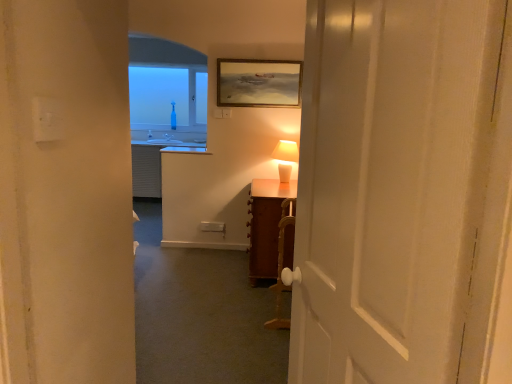
Image resolution: width=512 pixels, height=384 pixels. What do you see at coordinates (404, 194) in the screenshot?
I see `white wooden door at center` at bounding box center [404, 194].

Describe the element at coordinates (223, 113) in the screenshot. I see `white plastic electric outlet at upper center` at that location.

Measure the distance between wooden cabinet at right and camera.

They are 10.57 feet apart.

Identify the location of white wooden door at center. (404, 194).

Based on their sizes in the image, would you say wooden cabinet at right is bigger or smaller than white ceramic table lamp at center?

wooden cabinet at right is bigger than white ceramic table lamp at center.

Considering the sizes of objects wooden cabinet at right and white ceramic table lamp at center in the image provided, who is wider, wooden cabinet at right or white ceramic table lamp at center?

wooden cabinet at right.

Is wooden cabinet at right far from white ceramic table lamp at center?

wooden cabinet at right is actually quite close to white ceramic table lamp at center.

Is the depth of white plastic electric outlet at upper center greater than that of wooden cabinet at center?

Yes, the depth of white plastic electric outlet at upper center is greater than that of wooden cabinet at center.

Which is nearer, (230, 115) or (281, 325)?

Point (230, 115) is farther from the camera than point (281, 325).

Is white plastic electric outlet at upper center touching wooden cabinet at center?

No, white plastic electric outlet at upper center is not making contact with wooden cabinet at center.

Where is `furniture below the white plastic electric outlet at upper center (from a real-world perspective)`? furniture below the white plastic electric outlet at upper center (from a real-world perspective) is located at coordinates (282, 264).

Find the location of a particular element. The image size is (512, 384). picture frame above the wooden cabinet at center (from the image's perspective) is located at coordinates (258, 83).

Could you tell me if gold-framed painting at upper center is facing wooden cabinet at center?

No, gold-framed painting at upper center is not turned towards wooden cabinet at center.

From the image's perspective, which one is positioned higher, gold-framed painting at upper center or wooden cabinet at center?

gold-framed painting at upper center, from the image's perspective.

Can we say gold-framed painting at upper center lies outside wooden cabinet at center?

gold-framed painting at upper center is positioned outside wooden cabinet at center.

Is white wooden door at center thinner than gold-framed painting at upper center?

Incorrect, the width of white wooden door at center is not less than that of gold-framed painting at upper center.

Does white wooden door at center turn towards gold-framed painting at upper center?

No, white wooden door at center is not turned towards gold-framed painting at upper center.

Is point (487, 121) less distant than point (266, 68)?

Yes.

Does wooden cabinet at right have a lesser height compared to white plastic electric outlet at upper center?

In fact, wooden cabinet at right may be taller than white plastic electric outlet at upper center.

Where is `electric outlet located above the wooden cabinet at right (from a real-world perspective)`? Image resolution: width=512 pixels, height=384 pixels. electric outlet located above the wooden cabinet at right (from a real-world perspective) is located at coordinates (223, 113).

Considering the relative positions of wooden cabinet at right and white plastic electric outlet at upper center in the image provided, is wooden cabinet at right to the left of white plastic electric outlet at upper center from the viewer's perspective?

No, wooden cabinet at right is not to the left of white plastic electric outlet at upper center.

Can you tell me how much wooden cabinet at right and white plastic electric outlet at upper center differ in facing direction?

There is a 88.4-degree angle between the facing directions of wooden cabinet at right and white plastic electric outlet at upper center.

From the image's perspective, which one is positioned higher, transparent glass bottle at upper center or white wooden door at center?

From the image's view, transparent glass bottle at upper center is above.

Consider the image. Considering the positions of objects transparent glass bottle at upper center and white wooden door at center in the image provided, who is behind, transparent glass bottle at upper center or white wooden door at center?

transparent glass bottle at upper center.

Is transparent glass bottle at upper center inside the boundaries of white wooden door at center, or outside?

transparent glass bottle at upper center is not enclosed by white wooden door at center.

Is transparent glass bottle at upper center far away from white wooden door at center?

transparent glass bottle at upper center is far away from white wooden door at center.

From the image's perspective, does white plastic electric outlet at upper center appear higher than gold-framed painting at upper center?

No.

Consider the image. Which is more to the left, white plastic electric outlet at upper center or gold-framed painting at upper center?

white plastic electric outlet at upper center is more to the left.

Is there a large distance between white plastic electric outlet at upper center and gold-framed painting at upper center?

No, white plastic electric outlet at upper center is not far away from gold-framed painting at upper center.

Is gold-framed painting at upper center at the back of white plastic electric outlet at upper center?

white plastic electric outlet at upper center does not have its back to gold-framed painting at upper center.

Identify the location of table beneath the white ceramic table lamp at center (from a real-world perspective). The image size is (512, 384). (266, 225).

In the image, there is a wooden cabinet at center. At what (x,y) coordinates should I click in order to perform the action: click on electric outlet above it (from the image's perspective). Please return your answer as a coordinate pair (x, y). The image size is (512, 384). Looking at the image, I should click on (x=223, y=113).

Which object lies nearer to the anchor point gold-framed painting at upper center, white ceramic table lamp at center or wooden cabinet at right?

white ceramic table lamp at center.

Which object lies nearer to the anchor point gold-framed painting at upper center, white ceramic table lamp at center or white wooden door at center?

white ceramic table lamp at center is closer to gold-framed painting at upper center.

Estimate the real-world distances between objects in this image. Which object is closer to gold-framed painting at upper center, white wooden door at center or white plastic electric outlet at upper center?

Based on the image, white plastic electric outlet at upper center appears to be nearer to gold-framed painting at upper center.

When comparing their distances from gold-framed painting at upper center, does wooden cabinet at center or wooden cabinet at right seem closer?

Among the two, wooden cabinet at right is located nearer to gold-framed painting at upper center.

Which object lies further to the anchor point transparent glass bottle at upper center, white ceramic table lamp at center or wooden cabinet at center?

wooden cabinet at center is positioned further to the anchor transparent glass bottle at upper center.

When comparing their distances from wooden cabinet at center, does white wooden door at center or white plastic electric outlet at upper center seem further?

The object further to wooden cabinet at center is white wooden door at center.

When comparing their distances from white ceramic table lamp at center, does transparent glass bottle at upper center or gold-framed painting at upper center seem closer?

Based on the image, gold-framed painting at upper center appears to be nearer to white ceramic table lamp at center.

Looking at the image, which one is located closer to white plastic electric outlet at upper center, transparent glass bottle at upper center or gold-framed painting at upper center?

Based on the image, gold-framed painting at upper center appears to be nearer to white plastic electric outlet at upper center.

Find the location of a particular element. The height and width of the screenshot is (384, 512). table between wooden cabinet at center and transparent glass bottle at upper center along the z-axis is located at coordinates (266, 225).

Image resolution: width=512 pixels, height=384 pixels. Find the location of `table lamp located between white wooden door at center and gold-framed painting at upper center in the depth direction`. table lamp located between white wooden door at center and gold-framed painting at upper center in the depth direction is located at coordinates (285, 158).

Identify the location of electric outlet between white ceramic table lamp at center and transparent glass bottle at upper center from front to back. The height and width of the screenshot is (384, 512). click(x=223, y=113).

Find the location of a particular element. table lamp between gold-framed painting at upper center and wooden cabinet at right in the vertical direction is located at coordinates (285, 158).